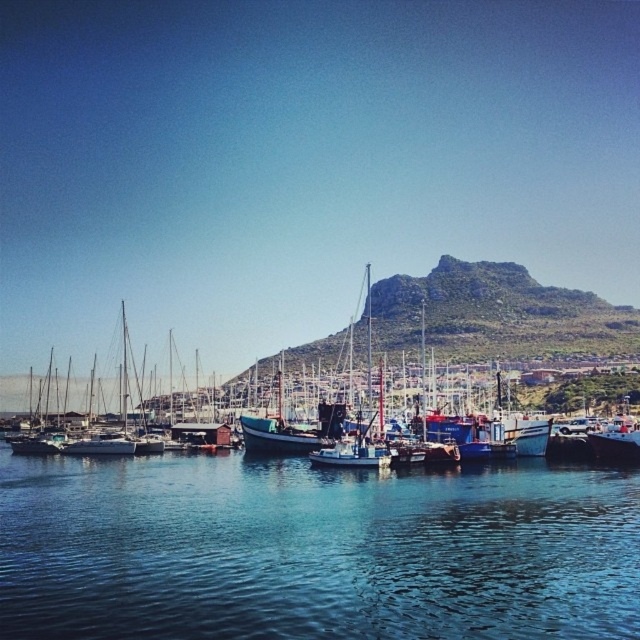
Who is more forward, (438, 493) or (532, 300)?

Positioned in front is point (438, 493).

Is point (172, 632) farther from viewer compared to point (509, 342)?

No, it is in front of (509, 342).

The image size is (640, 640). I want to click on blue water at center, so click(x=314, y=550).